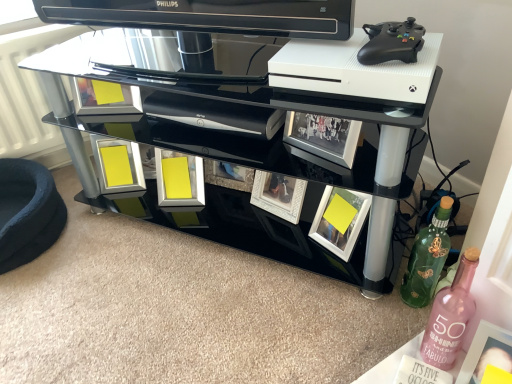
You are a GUI agent. You are given a task and a screenshot of the screen. Output one action in this format:
    pyautogui.click(x=<x>, y=<y>)
    Task: Click on the free space in front of velvet cushion at lower left
    The height and width of the screenshot is (384, 512).
    Given the screenshot: What is the action you would take?
    pyautogui.click(x=49, y=296)